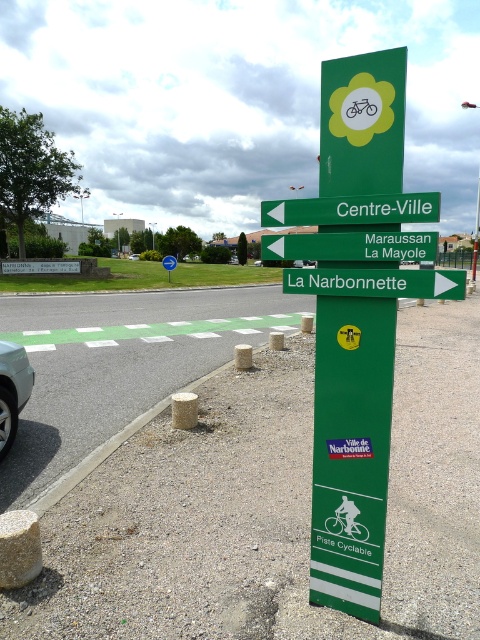
Question: Is green plastic sign at center-right bigger than silver metallic car at lower left?

Choices:
 (A) yes
 (B) no

Answer: (B)

Question: Which of the following is the closest to the observer?

Choices:
 (A) green plastic sign at center-right
 (B) green plastic sign at center
 (C) white rubber car at lower left

Answer: (A)

Question: Which of the following is the closest to the observer?

Choices:
 (A) (254, 266)
 (B) (315, 237)

Answer: (B)

Question: Can you confirm if green plastic sign at center is positioned above silver metallic car at lower left?

Choices:
 (A) no
 (B) yes

Answer: (A)

Question: Is white glossy car at center-left smaller than silver metallic car at lower left?

Choices:
 (A) yes
 (B) no

Answer: (A)

Question: Which point is farther from the camera taking this photo?

Choices:
 (A) (356, 257)
 (B) (322, 200)
 (C) (139, 257)

Answer: (C)